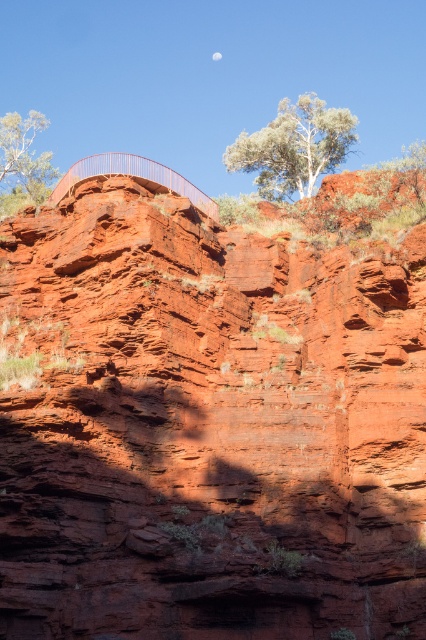
Question: Which object is positioned closest to the reddish-brown rock at upper center?

Choices:
 (A) white textured tree at upper center
 (B) metallic railing at upper center
 (C) green leafy tree at upper left

Answer: (B)

Question: Does white textured tree at upper center appear under metallic railing at upper center?

Choices:
 (A) yes
 (B) no

Answer: (B)

Question: Is green leafy tree at upper left closer to camera compared to metallic railing at upper center?

Choices:
 (A) yes
 (B) no

Answer: (B)

Question: Which point is closer to the camera taking this photo?

Choices:
 (A) (192, 188)
 (B) (273, 500)
 (C) (242, 138)
 (D) (0, 145)

Answer: (B)

Question: Does reddish-brown rock at upper center appear over white textured tree at upper center?

Choices:
 (A) yes
 (B) no

Answer: (B)

Question: Which of the following is the farthest from the observer?

Choices:
 (A) white textured tree at upper center
 (B) reddish-brown rock at upper center
 (C) green leafy tree at upper left

Answer: (A)